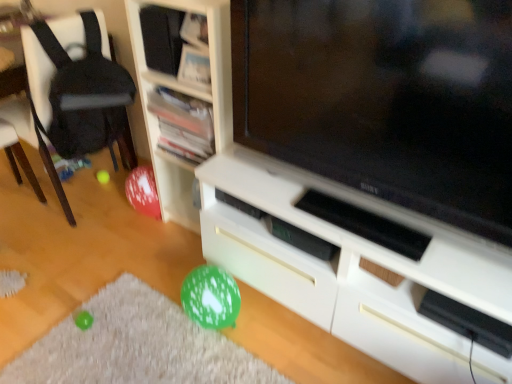
Question: Does matte black television at center contain white wood shelf at center, marked as the third shelf in a top-to-bottom arrangement?

Choices:
 (A) yes
 (B) no

Answer: (B)

Question: From a real-world perspective, is matte black television at center below white wood shelf at center, marked as the third shelf in a top-to-bottom arrangement?

Choices:
 (A) no
 (B) yes

Answer: (A)

Question: Is matte black television at center to the left of white wood shelf at center, marked as the third shelf in a top-to-bottom arrangement, from the viewer's perspective?

Choices:
 (A) no
 (B) yes

Answer: (A)

Question: Considering the relative sizes of matte black television at center and white wood shelf at center, positioned as the first shelf in bottom-to-top order, in the image provided, is matte black television at center thinner than white wood shelf at center, positioned as the first shelf in bottom-to-top order,?

Choices:
 (A) no
 (B) yes

Answer: (B)

Question: Are matte black television at center and white wood shelf at center, marked as the third shelf in a top-to-bottom arrangement, far apart?

Choices:
 (A) no
 (B) yes

Answer: (A)

Question: From the image's perspective, is white matte cabinet at center positioned above or below matte black television at center?

Choices:
 (A) above
 (B) below

Answer: (B)

Question: Based on their sizes in the image, would you say white matte cabinet at center is bigger or smaller than matte black television at center?

Choices:
 (A) big
 (B) small

Answer: (A)

Question: In terms of height, does white matte cabinet at center look taller or shorter compared to matte black television at center?

Choices:
 (A) tall
 (B) short

Answer: (B)

Question: Would you say white matte cabinet at center is to the left or to the right of matte black television at center in the picture?

Choices:
 (A) left
 (B) right

Answer: (B)

Question: Is point (224, 34) closer or farther from the camera than point (134, 61)?

Choices:
 (A) closer
 (B) farther

Answer: (A)

Question: Based on their sizes in the image, would you say white wood shelf at center, positioned as the first shelf in bottom-to-top order, is bigger or smaller than matte black speaker at upper center, which is the first shelf from top to bottom?

Choices:
 (A) small
 (B) big

Answer: (B)

Question: In terms of width, does white wood shelf at center, positioned as the first shelf in bottom-to-top order, look wider or thinner when compared to matte black speaker at upper center, which is the first shelf from top to bottom?

Choices:
 (A) wide
 (B) thin

Answer: (A)

Question: From the image's perspective, relative to matte black speaker at upper center, which is the first shelf from top to bottom, is white wood shelf at center, positioned as the first shelf in bottom-to-top order, above or below?

Choices:
 (A) below
 (B) above

Answer: (A)

Question: Considering the positions of point (92, 145) and point (243, 49), is point (92, 145) closer or farther from the camera than point (243, 49)?

Choices:
 (A) closer
 (B) farther

Answer: (B)

Question: Considering the positions of black fabric chair at left and matte black television at center in the image, is black fabric chair at left bigger or smaller than matte black television at center?

Choices:
 (A) big
 (B) small

Answer: (A)